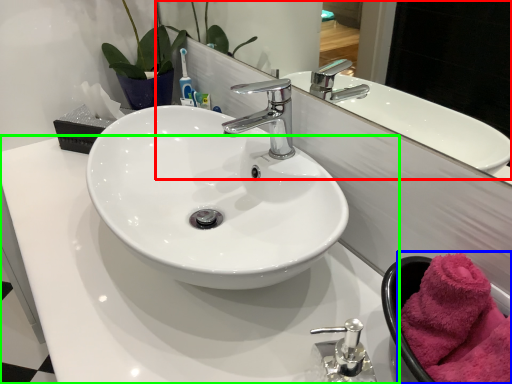
Question: Based on their relative distances, which object is farther from mirror (highlighted by a red box)? Choose from bath towel (highlighted by a blue box) and counter top (highlighted by a green box).

Choices:
 (A) bath towel
 (B) counter top

Answer: (A)